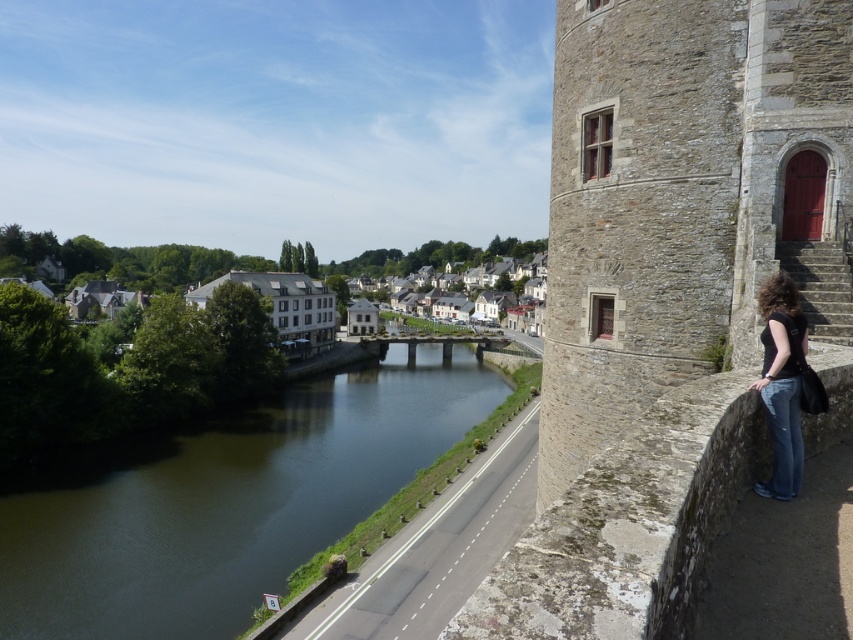
You are a tourist visiting the town and want to take a photo of both the stone tower at right and the white stone houses at center. Which object will appear wider in the photo?

The white stone houses at center will appear wider in the photo because the stone tower at right has a lesser width compared to them.

You are a tourist standing at the viewpoint overlooking the river and town. You notice the black matte shirt at lower right and the white stone houses at center. Which object is closer to your viewpoint?

The black matte shirt at lower right is closer to your viewpoint because it is positioned under the white stone houses at center, indicating it is in a lower elevation area.